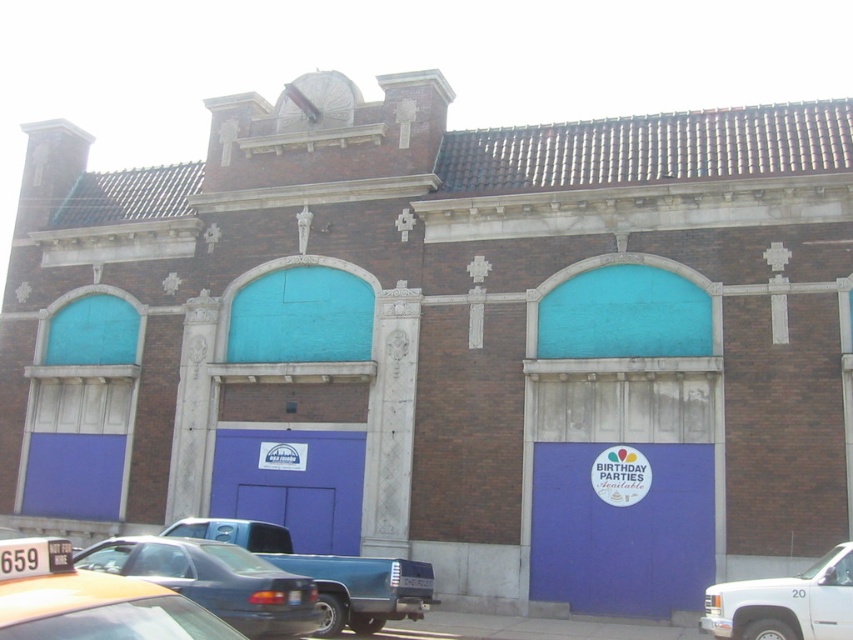
Question: Does blue matte garage door at center appear on the right side of white matte truck at lower right?

Choices:
 (A) no
 (B) yes

Answer: (A)

Question: From the image, what is the correct spatial relationship of blue matte garage door at lower right in relation to blue matte garage door at center?

Choices:
 (A) above
 (B) below

Answer: (B)

Question: Which object is positioned farthest from the blue matte garage door at lower right?

Choices:
 (A) metallic blue truck at lower center
 (B) white matte truck at lower right
 (C) yellow rubber taxi cab at lower left

Answer: (C)

Question: Can you confirm if blue matte garage door at lower right is smaller than blue matte garage door at center?

Choices:
 (A) no
 (B) yes

Answer: (B)

Question: Which point is closer to the camera?

Choices:
 (A) (323, 520)
 (B) (192, 529)
 (C) (706, 589)
 (D) (671, 560)

Answer: (B)

Question: Which object is closer to the camera taking this photo?

Choices:
 (A) yellow rubber taxi cab at lower left
 (B) metallic blue truck at lower center

Answer: (A)